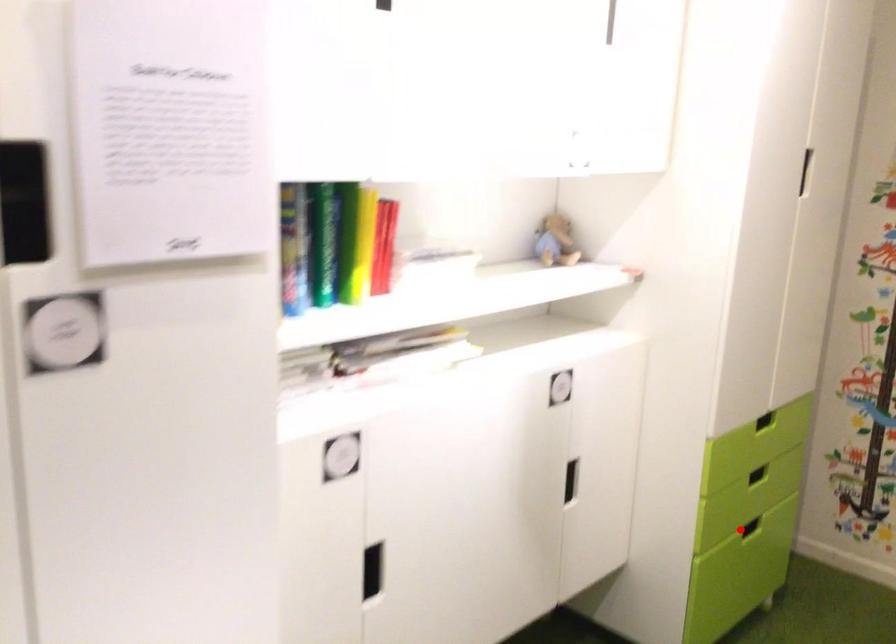
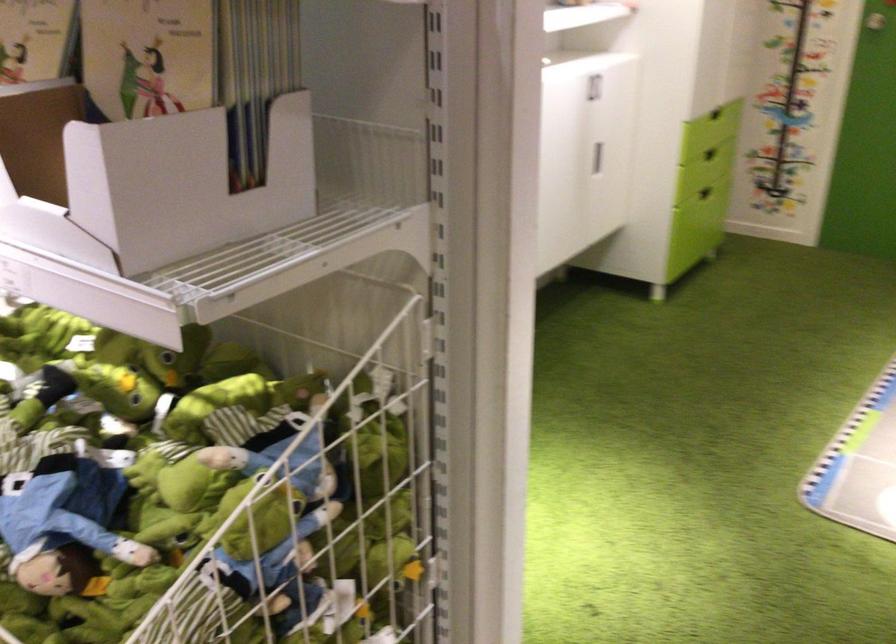
Find the pixel in the second image that matches the highlighted location in the first image.

(704, 193)